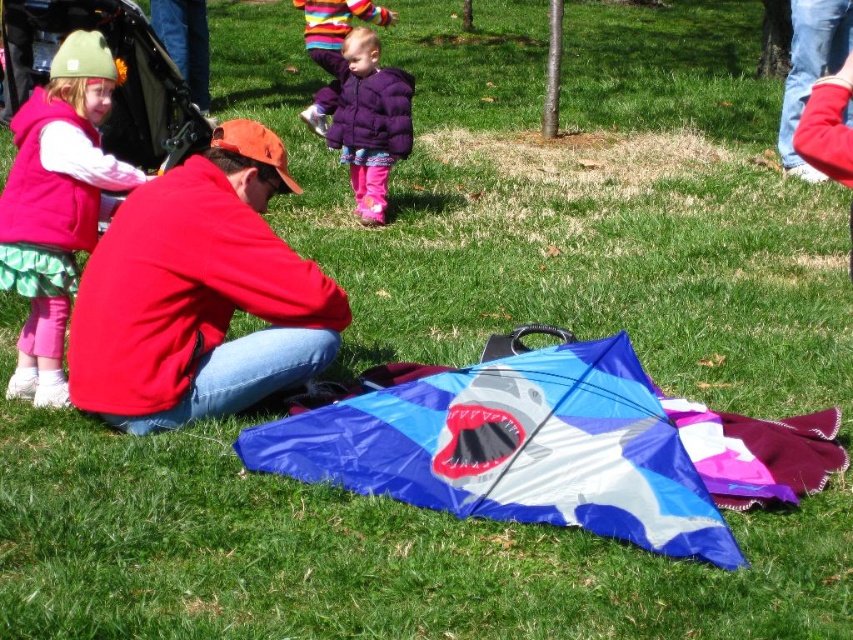
Is red fleece jacket at center positioned at the back of purple puffy coat at center?

No, red fleece jacket at center is closer to the viewer.

Who is positioned more to the left, red fleece jacket at center or purple puffy coat at center?

Positioned to the left is red fleece jacket at center.

Locate an element on the screen. Image resolution: width=853 pixels, height=640 pixels. red fleece jacket at center is located at coordinates (196, 292).

Does point (648, 508) lie behind point (383, 100)?

No, it is in front of (383, 100).

Who is taller, blue fabric kite at center or purple puffy coat at center?

purple puffy coat at center

Describe the element at coordinates (515, 449) in the screenshot. I see `blue fabric kite at center` at that location.

The height and width of the screenshot is (640, 853). In order to click on blue fabric kite at center in this screenshot , I will do `click(515, 449)`.

Is matte pink vest at left to the left of purple puffy coat at center from the viewer's perspective?

Yes, matte pink vest at left is to the left of purple puffy coat at center.

Looking at this image, can you confirm if matte pink vest at left is positioned below purple puffy coat at center?

Yes, matte pink vest at left is below purple puffy coat at center.

At what (x,y) coordinates should I click in order to perform the action: click on matte pink vest at left. Please return your answer as a coordinate pair (x, y). Looking at the image, I should click on (56, 204).

This screenshot has height=640, width=853. I want to click on matte pink vest at left, so click(56, 204).